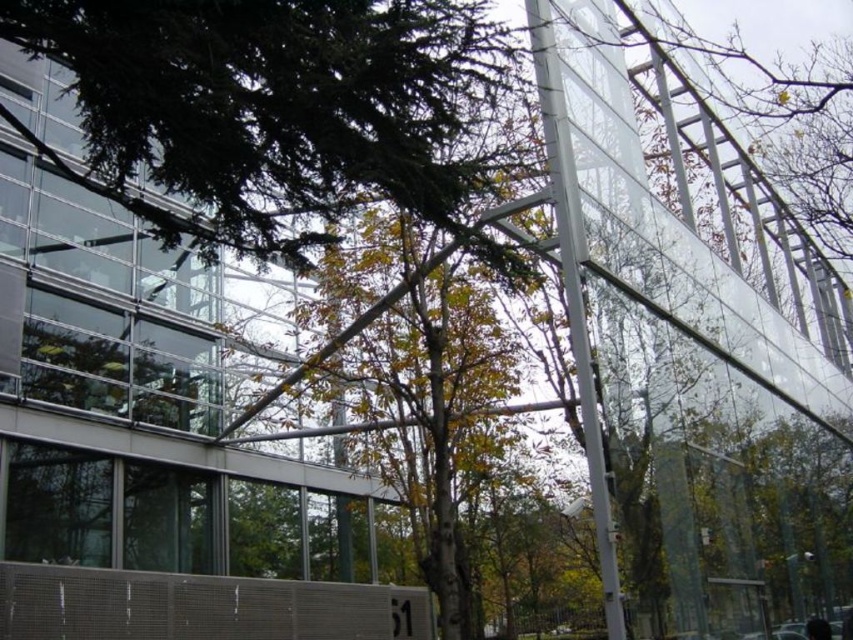
Question: Considering the relative positions of green leafy tree at upper center and green leafy tree at center in the image provided, where is green leafy tree at upper center located with respect to green leafy tree at center?

Choices:
 (A) below
 (B) above

Answer: (B)

Question: Among these points, which one is nearest to the camera?

Choices:
 (A) click(x=236, y=422)
 (B) click(x=267, y=65)

Answer: (B)

Question: Among these objects, which one is farthest from the camera?

Choices:
 (A) green leafy tree at upper center
 (B) green leafy tree at center

Answer: (B)

Question: Can you confirm if green leafy tree at upper center is thinner than green leafy tree at center?

Choices:
 (A) no
 (B) yes

Answer: (B)

Question: Is green leafy tree at upper center further to the viewer compared to green leafy tree at center?

Choices:
 (A) no
 (B) yes

Answer: (A)